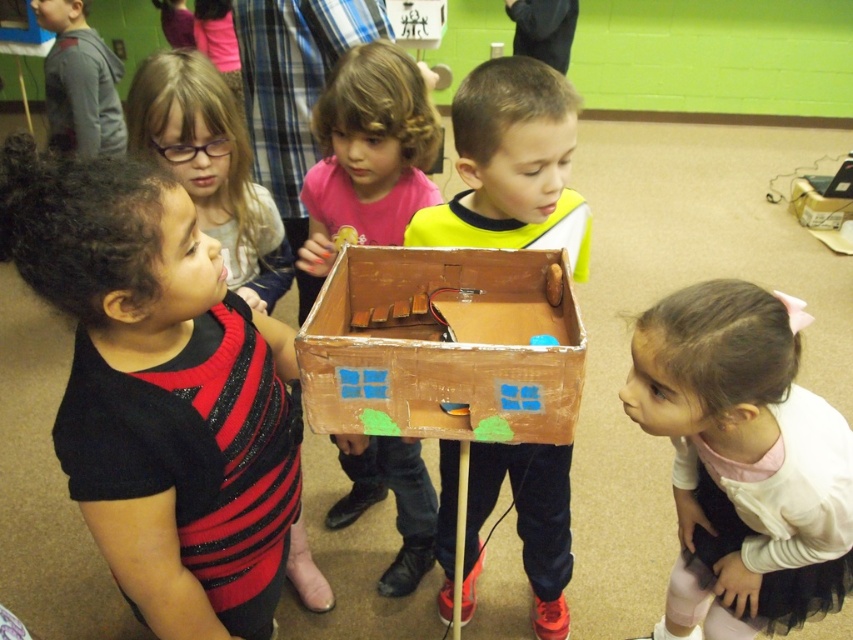
Question: Is the position of matte cardboard box at center more distant than that of black glitter dress at left?

Choices:
 (A) yes
 (B) no

Answer: (A)

Question: Which object appears closest to the camera in this image?

Choices:
 (A) cardboard box at center
 (B) matte cardboard box at center

Answer: (B)

Question: Does black glitter tank top at left appear over black glitter dress at left?

Choices:
 (A) no
 (B) yes

Answer: (A)

Question: Which object is farther from the camera taking this photo?

Choices:
 (A) brown cardboard box at upper right
 (B) pink tulle skirt at lower right

Answer: (A)

Question: Can you confirm if black glitter tank top at left is wider than pink tulle skirt at lower right?

Choices:
 (A) yes
 (B) no

Answer: (B)

Question: Which point appears farthest from the camera in this image?

Choices:
 (A) (795, 182)
 (B) (567, 284)

Answer: (A)